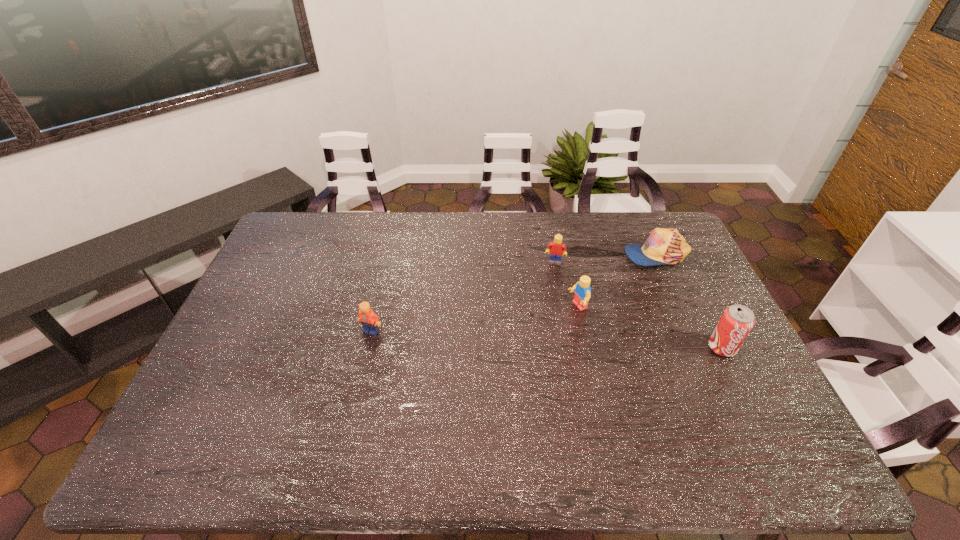
Locate an element on the screen. The width and height of the screenshot is (960, 540). free point between the shortest object and the farthest Lego is located at coordinates (605, 259).

At what (x,y) coordinates should I click in order to perform the action: click on free space between the leftmost object and the second nearest Lego. Please return your answer as a coordinate pair (x, y). This screenshot has height=540, width=960. Looking at the image, I should click on (474, 319).

Identify the location of empty space between the tallest object and the leftmost Lego. Image resolution: width=960 pixels, height=540 pixels. (546, 339).

Find the location of a particular element. This screenshot has width=960, height=540. vacant point located between the soda can and the fourth farthest object is located at coordinates (546, 339).

Locate an element on the screen. free space between the farthest Lego and the tallest object is located at coordinates (638, 305).

Image resolution: width=960 pixels, height=540 pixels. I want to click on free space between the shortest object and the farthest Lego, so click(605, 259).

You are a GUI agent. You are given a task and a screenshot of the screen. Output one action in this format:
    pyautogui.click(x=<x>, y=<y>)
    Task: Click on the object that is the closest to the leftmost Lego
    This screenshot has width=960, height=540.
    Given the screenshot: What is the action you would take?
    pyautogui.click(x=582, y=295)

Locate which object is the second closest to the nearest object. Please provide its 2D coordinates. Your answer should be formatted as a tuple, i.e. [(x, y)], where the tuple contains the x and y coordinates of a point satisfying the conditions above.

[(582, 295)]

Choose which Lego is the second nearest neighbor to the third nearest object. Please provide its 2D coordinates. Your answer should be formatted as a tuple, i.e. [(x, y)], where the tuple contains the x and y coordinates of a point satisfying the conditions above.

[(369, 320)]

Locate an element on the screen. Lego that is the closest to the leftmost Lego is located at coordinates (582, 295).